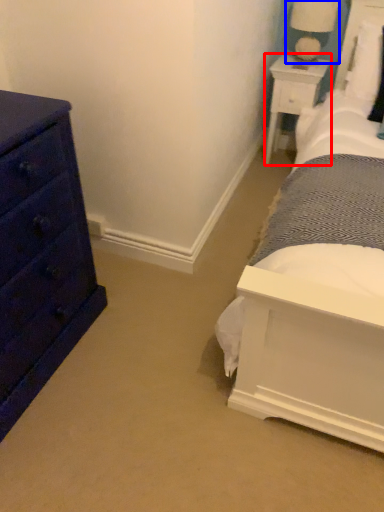
Question: Which object is closer to the camera taking this photo, nightstand (highlighted by a red box) or table lamp (highlighted by a blue box)?

Choices:
 (A) nightstand
 (B) table lamp

Answer: (B)